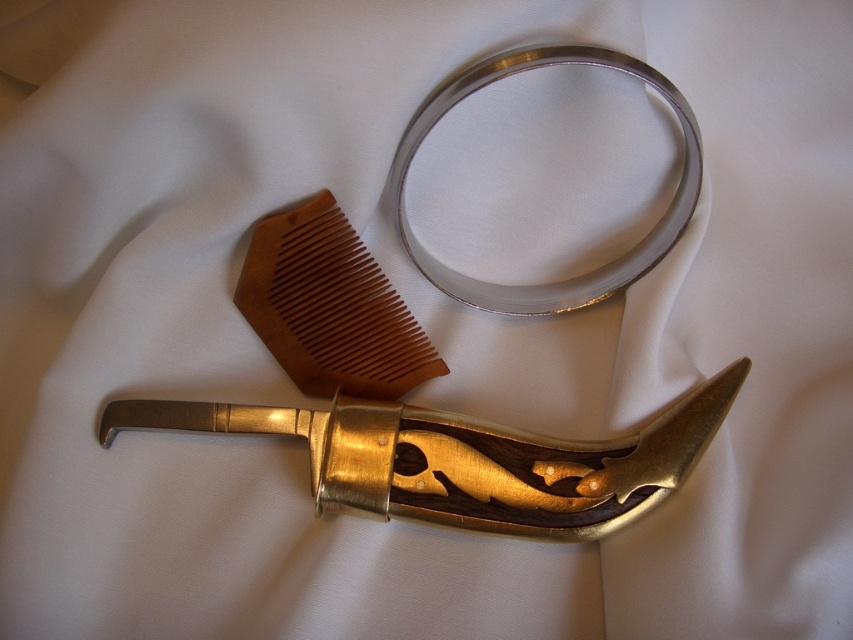
Between brown wood comb at center-left and silver metallic ring at upper center, which one has less height?

With less height is brown wood comb at center-left.

Does brown wood comb at center-left appear under silver metallic ring at upper center?

Correct, brown wood comb at center-left is located below silver metallic ring at upper center.

Which is in front, point (291, 280) or point (688, 205)?

Point (688, 205) is more forward.

Image resolution: width=853 pixels, height=640 pixels. In order to click on brown wood comb at center-left in this screenshot , I will do `click(329, 307)`.

Who is shorter, gold polished metal sword at lower center or brown wood comb at center-left?

gold polished metal sword at lower center is shorter.

In the scene shown: Measure the distance between gold polished metal sword at lower center and camera.

They are 4.15 feet apart.

Is point (387, 497) less distant than point (351, 228)?

That is True.

Find the location of `gold polished metal sword at lower center`. gold polished metal sword at lower center is located at coordinates (465, 460).

From the picture: Does gold polished metal sword at lower center have a larger size compared to silver metallic ring at upper center?

Incorrect, gold polished metal sword at lower center is not larger than silver metallic ring at upper center.

Looking at this image, can you confirm if gold polished metal sword at lower center is thinner than silver metallic ring at upper center?

In fact, gold polished metal sword at lower center might be wider than silver metallic ring at upper center.

The width and height of the screenshot is (853, 640). Identify the location of gold polished metal sword at lower center. (465, 460).